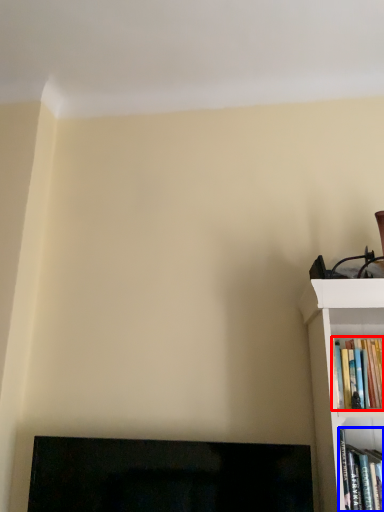
Question: Which object is further to the camera taking this photo, book (highlighted by a red box) or book (highlighted by a blue box)?

Choices:
 (A) book
 (B) book

Answer: (A)